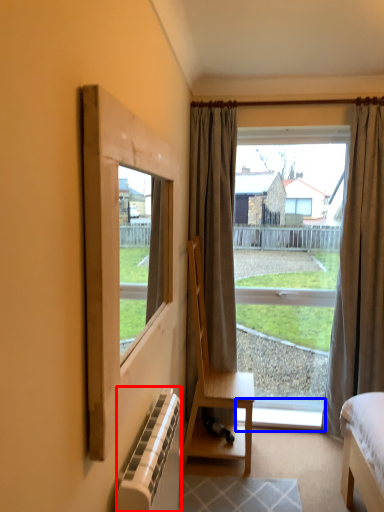
Question: Among these objects, which one is nearest to the camera, radiator (highlighted by a red box) or window sill (highlighted by a blue box)?

Choices:
 (A) radiator
 (B) window sill

Answer: (A)